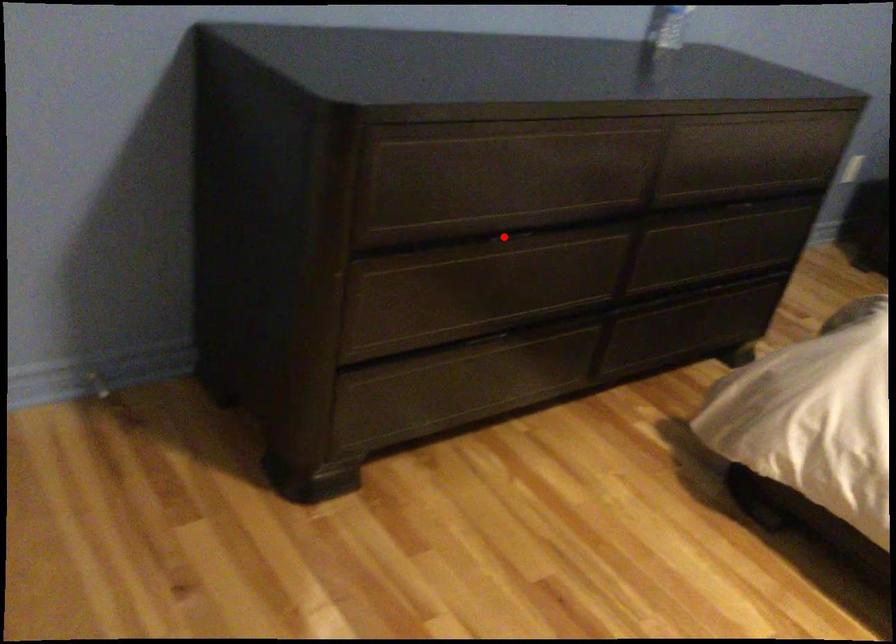
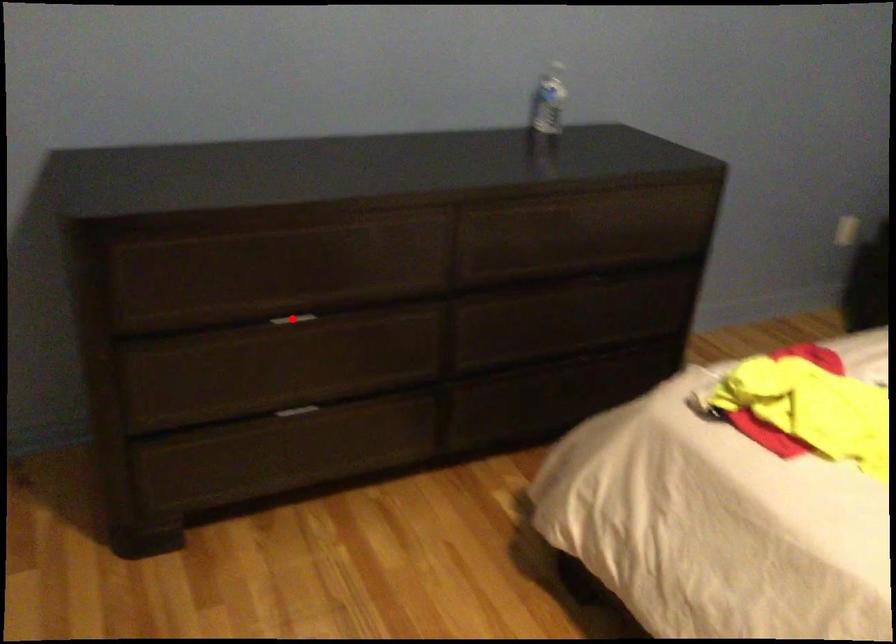
I am providing you with two images of the same scene from different viewpoints. A red point is marked on the first image and another point is marked on the second image. Do the highlighted points in image1 and image2 indicate the same real-world spot?

Yes